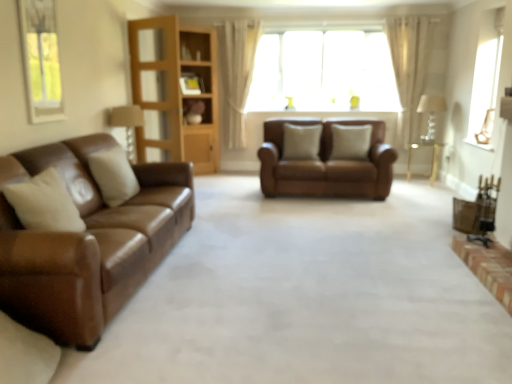
Question: From the image's perspective, relative to beige fabric pillow at center, arranged as the 2th pillow when viewed from the back, is metallic gold chair at lower right above or below?

Choices:
 (A) below
 (B) above

Answer: (A)

Question: Considering the positions of metallic gold chair at lower right and beige fabric pillow at center, the 2th pillow viewed from the front, in the image, is metallic gold chair at lower right wider or thinner than beige fabric pillow at center, the 2th pillow viewed from the front,?

Choices:
 (A) wide
 (B) thin

Answer: (B)

Question: Which object is the farthest from the beige fabric pillow at center, which is counted as the second pillow, starting from the right?

Choices:
 (A) matte wooden lamp at left, which appears as the 1th lamp when viewed from the front
 (B) brown leather couch at left, the second studio couch positioned from the right
 (C) translucent fabric window at center, which appears as the second window when viewed from the front
 (D) translucent glass lampshade at upper right, the second lamp from the front
 (E) beige fabric pillow at center, the 2th pillow viewed from the front

Answer: (B)

Question: Which object is the farthest from the clear glass window at upper right, marked as the first window in a right-to-left arrangement?

Choices:
 (A) brown leather couch at left, the second studio couch positioned from the right
 (B) brown leather couch at center, acting as the 1th studio couch starting from the back
 (C) translucent fabric window at center, the first window when ordered from left to right
 (D) beige fabric pillow at center, the 3th pillow viewed from the left
 (E) translucent glass lampshade at upper right, marked as the 2th lamp in a left-to-right arrangement

Answer: (A)